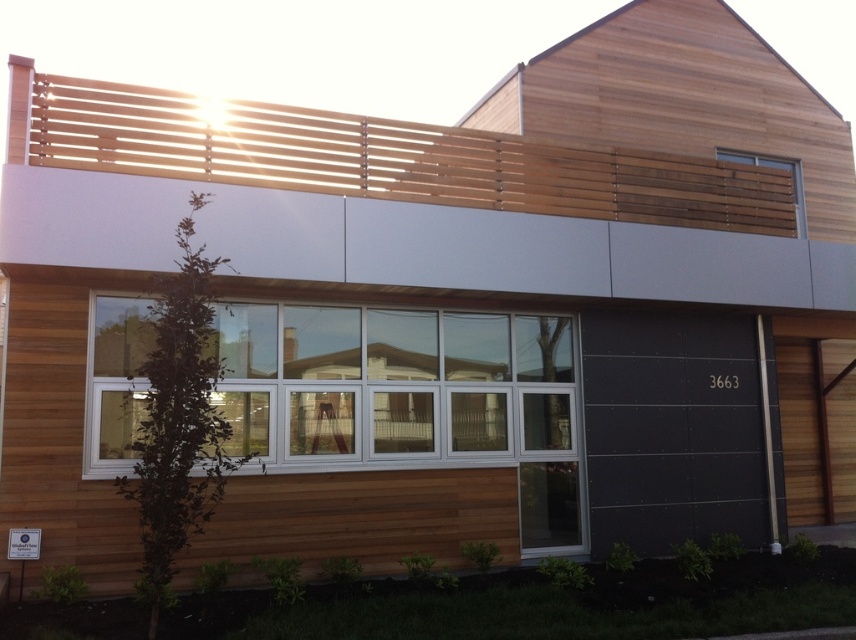
You are a window installer assessing the house. You need to replace the clear glass window at center and the wooden slats at upper right. Which object requires a wider replacement material?

The clear glass window at center requires wider replacement material because it might be wider than the wooden slats at upper right.

You are a window installer assessing the house. You need to replace the clear glass window at center and the wooden slats at upper right. Which object requires a larger replacement material?

The clear glass window at center requires larger replacement material since it is larger in size than the wooden slats at upper right.

You are standing in front of the modern two story house and want to know the position of the clear glass window at center relative to the wooden slats at upper right. Which one is on the left side?

The clear glass window at center is positioned on the left side of wooden slats at upper right.